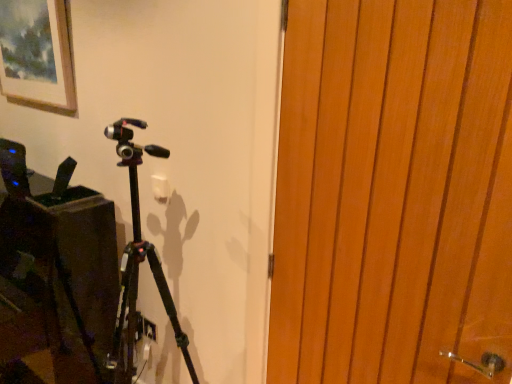
Question: Does point (262, 299) appear closer or farther from the camera than point (47, 3)?

Choices:
 (A) closer
 (B) farther

Answer: (A)

Question: Is black matte tripod at center spatially inside matte wooden picture frame at upper left, or outside of it?

Choices:
 (A) outside
 (B) inside

Answer: (A)

Question: Estimate the real-world distances between objects in this image. Which object is farther from the matte wooden picture frame at upper left?

Choices:
 (A) black matte tripod at center
 (B) wooden door at right

Answer: (B)

Question: Which object is positioned farthest from the black matte tripod at center?

Choices:
 (A) matte wooden picture frame at upper left
 (B) wooden door at right

Answer: (A)